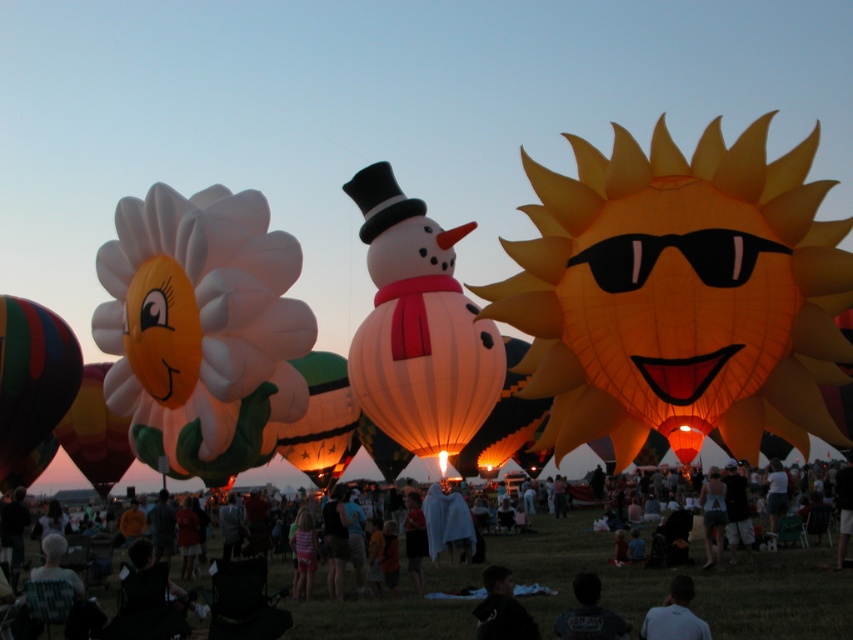
This screenshot has width=853, height=640. Describe the element at coordinates (694, 580) in the screenshot. I see `matte black jacket at center` at that location.

Does matte black jacket at center appear under multicolored striped hot air balloon at left?

Yes.

Is point (541, 604) closer to viewer compared to point (21, 298)?

Yes, it is.

The height and width of the screenshot is (640, 853). Find the location of `matte black jacket at center`. matte black jacket at center is located at coordinates tap(694, 580).

Which is in front, point (576, 369) or point (679, 634)?

Positioned in front is point (679, 634).

Is point (747, 436) behind point (674, 586)?

Yes, it is behind point (674, 586).

The image size is (853, 640). What do you see at coordinates (679, 288) in the screenshot?
I see `matte orange sun at center` at bounding box center [679, 288].

Locate an element on the screen. The image size is (853, 640). matte orange sun at center is located at coordinates (679, 288).

In the scene shown: Who is higher up, black fabric at lower center or denim shorts at lower right?

Positioned higher is denim shorts at lower right.

Does black fabric at lower center appear under denim shorts at lower right?

Indeed, black fabric at lower center is positioned under denim shorts at lower right.

Describe the element at coordinates (502, 609) in the screenshot. I see `black fabric at lower center` at that location.

The image size is (853, 640). Identify the location of black fabric at lower center. (502, 609).